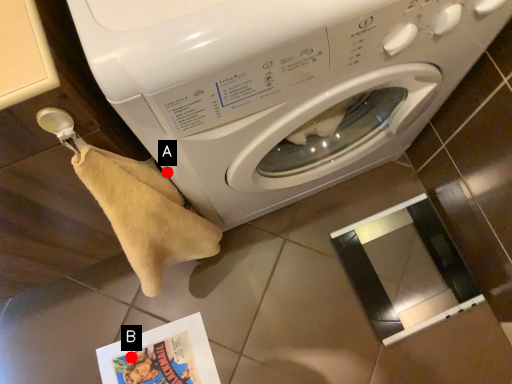
Question: Two points are circled on the image, labeled by A and B beside each circle. Which point appears closest to the camera in this image?

Choices:
 (A) A is closer
 (B) B is closer

Answer: (A)